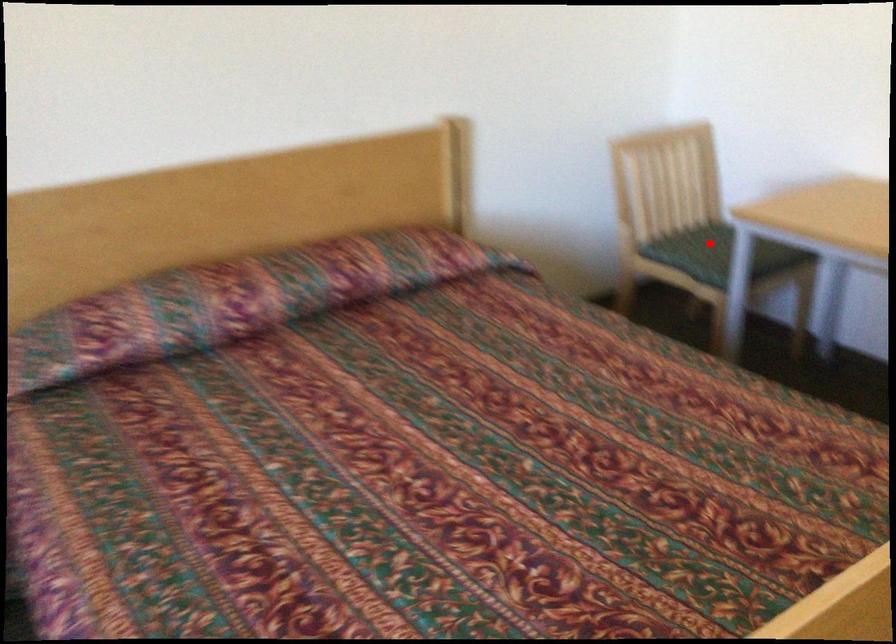
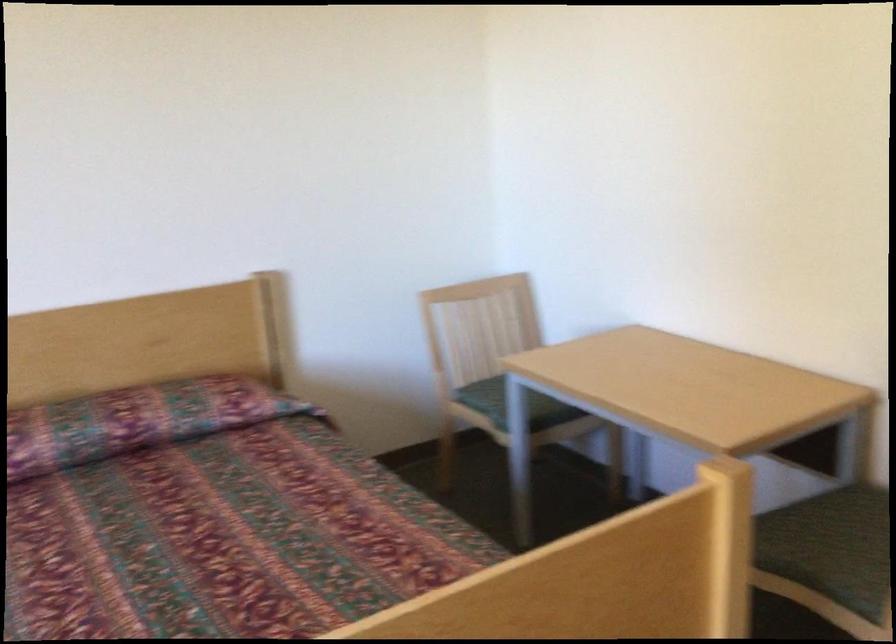
Question: I am providing you with two images of the same scene from different viewpoints. A red point is marked on the first image. Is the red point's position out of view in image 2?

Choices:
 (A) Yes
 (B) No

Answer: (A)